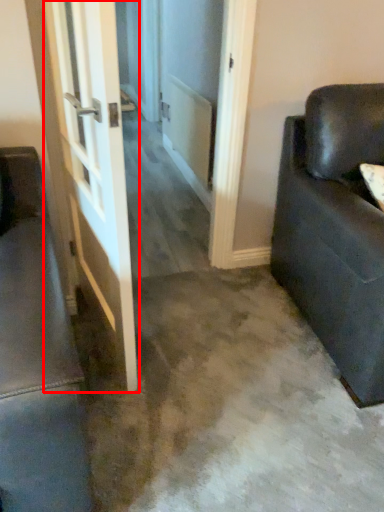
Question: From the image's perspective, what is the correct spatial relationship of door (annotated by the red box) in relation to studio couch?

Choices:
 (A) above
 (B) below

Answer: (A)